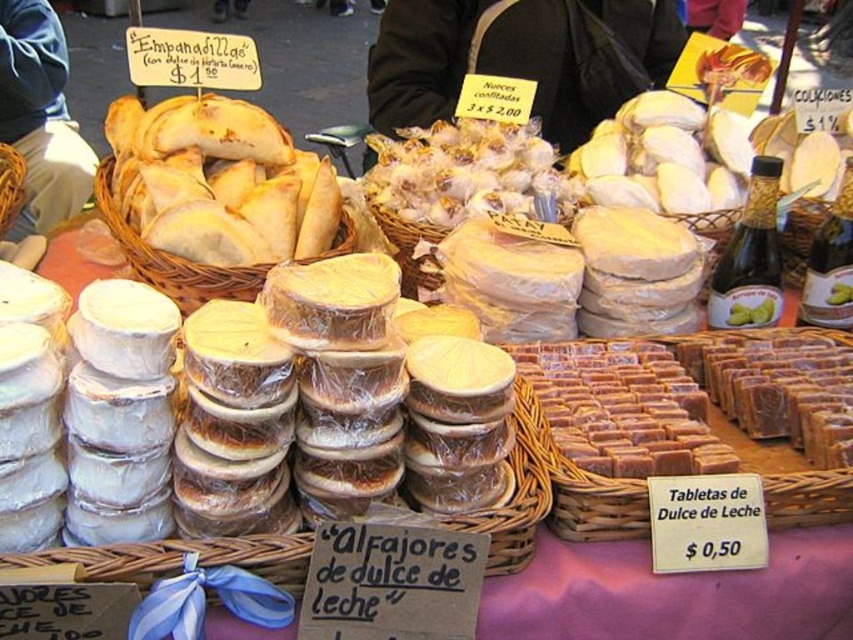
Which is below, brown woven basket at center or woven brown basket at left?

brown woven basket at center

Between brown woven basket at center and woven brown basket at left, which one has more height?

Standing taller between the two is brown woven basket at center.

Which is in front, point (693, 458) or point (3, 212)?

Positioned in front is point (693, 458).

Identify the location of brown woven basket at center. The image size is (853, 640). (692, 422).

Based on the photo, is purple fabric at lower center taller than white plastic containers at center?

No.

Can you confirm if purple fabric at lower center is positioned above white plastic containers at center?

No, purple fabric at lower center is not above white plastic containers at center.

Where is `purple fabric at lower center`? The height and width of the screenshot is (640, 853). purple fabric at lower center is located at coordinates (674, 593).

Between translucent plastic garlic at center and brown wicker basket at center, which one is positioned lower?

brown wicker basket at center is lower down.

Which is behind, point (447, 134) or point (99, 209)?

The point (447, 134) is behind.

Does point (453, 173) lie behind point (231, 276)?

Yes, point (453, 173) is behind point (231, 276).

I want to click on translucent plastic garlic at center, so click(x=465, y=172).